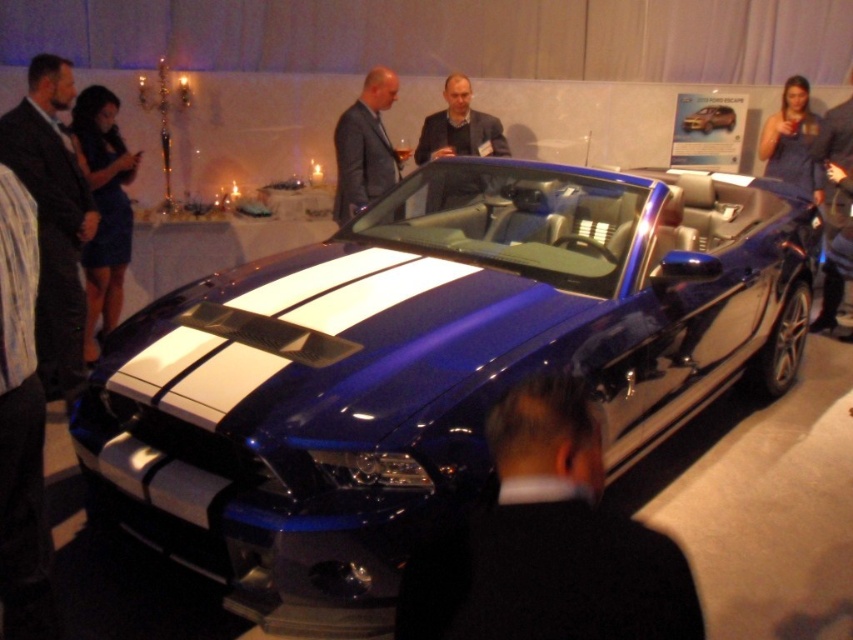
Question: Observing the image, what is the correct spatial positioning of dark blue suit at center in reference to glossy metallic car at center?

Choices:
 (A) above
 (B) below

Answer: (B)

Question: Which of the following is the farthest from the observer?

Choices:
 (A) (688, 570)
 (B) (386, 77)
 (C) (704, 129)
 (D) (463, 186)

Answer: (C)

Question: Which object appears farthest from the camera in this image?

Choices:
 (A) black leather jacket at lower center
 (B) dark brown suit at left

Answer: (B)

Question: Is the position of dark blue dress at left more distant than that of dark blue suit at center?

Choices:
 (A) no
 (B) yes

Answer: (A)

Question: Is shiny blue convertible at center above dark blue suit at center?

Choices:
 (A) yes
 (B) no

Answer: (B)

Question: Which point is closer to the camera?

Choices:
 (A) dark brown suit at left
 (B) shiny blue convertible at center
 (C) matte gray suit at center

Answer: (B)